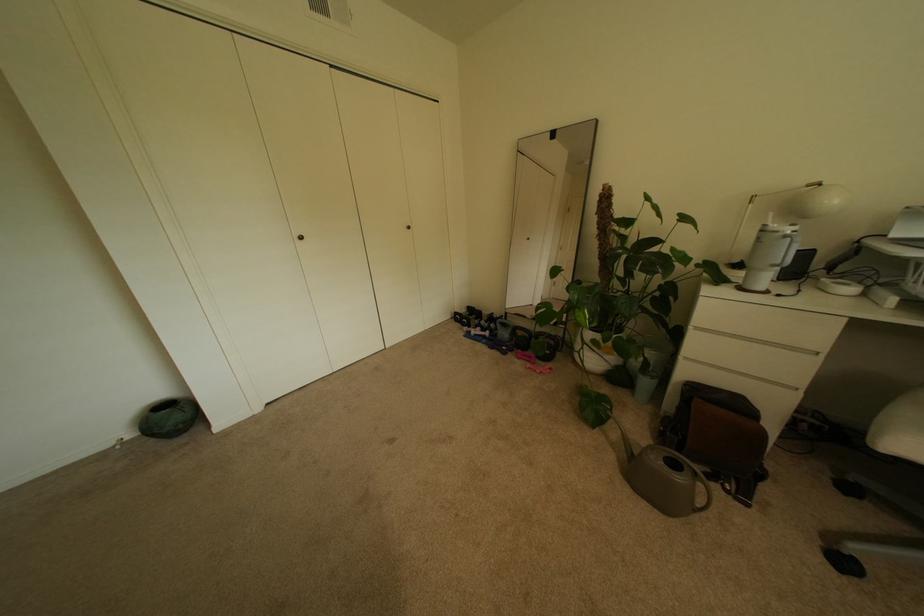
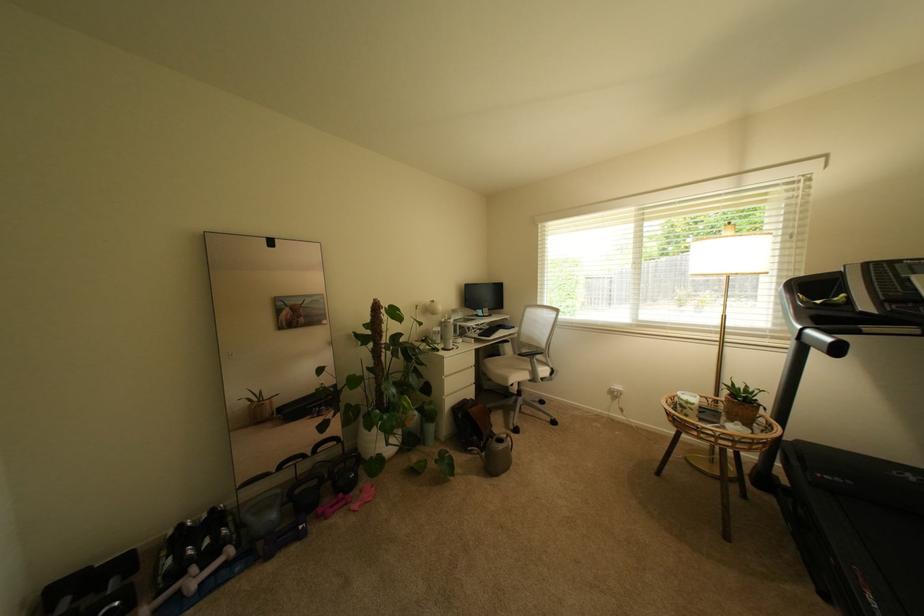
Where in the second image is the point corresponding to the point at 531,357 from the first image?

(339, 508)